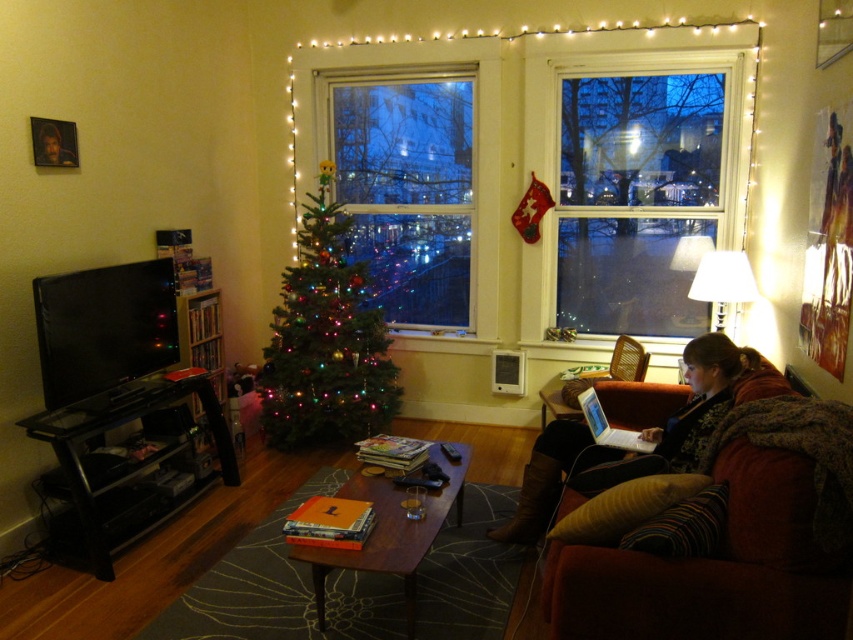
Question: Based on their relative distances, which object is farther from the smooth brown leather jacket at lower right?

Choices:
 (A) transparent glass window at center
 (B) brown woven armchair at right

Answer: (A)

Question: Is transparent glass window at center further to camera compared to leather boots at lower right?

Choices:
 (A) no
 (B) yes

Answer: (B)

Question: Among these points, which one is farthest from the camera?

Choices:
 (A) (318, 221)
 (B) (624, 435)
 (C) (637, 576)
 (D) (381, 301)

Answer: (D)

Question: Is leather boots at lower right below smooth brown leather jacket at lower right?

Choices:
 (A) yes
 (B) no

Answer: (A)

Question: Observing the image, what is the correct spatial positioning of brown fabric couch at lower right in reference to leather boots at lower right?

Choices:
 (A) left
 (B) right

Answer: (A)

Question: Which object is farther from the camera taking this photo?

Choices:
 (A) smooth brown leather jacket at lower right
 (B) brown woven armchair at right
 (C) illuminated glass window at center
 (D) leather boots at lower right

Answer: (C)